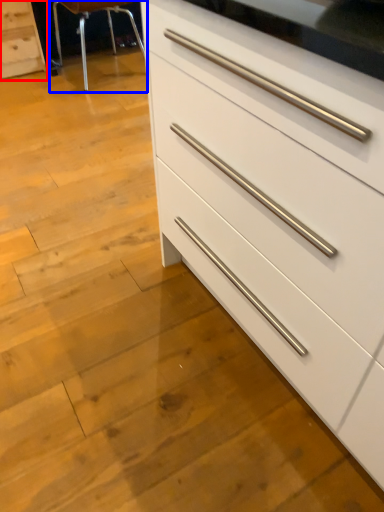
Question: Among these objects, which one is nearest to the camera, chest of drawers (highlighted by a red box) or bar stool (highlighted by a blue box)?

Choices:
 (A) chest of drawers
 (B) bar stool

Answer: (B)